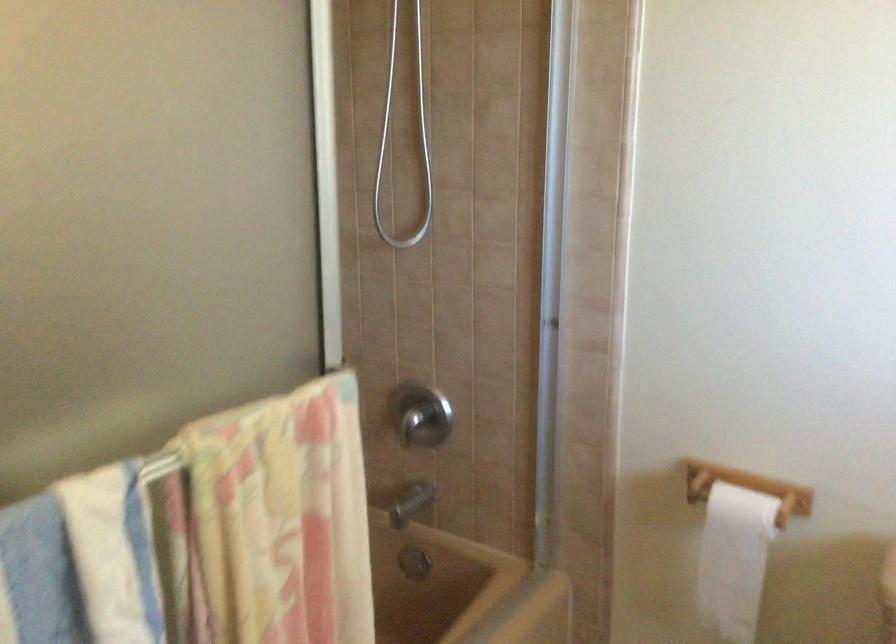
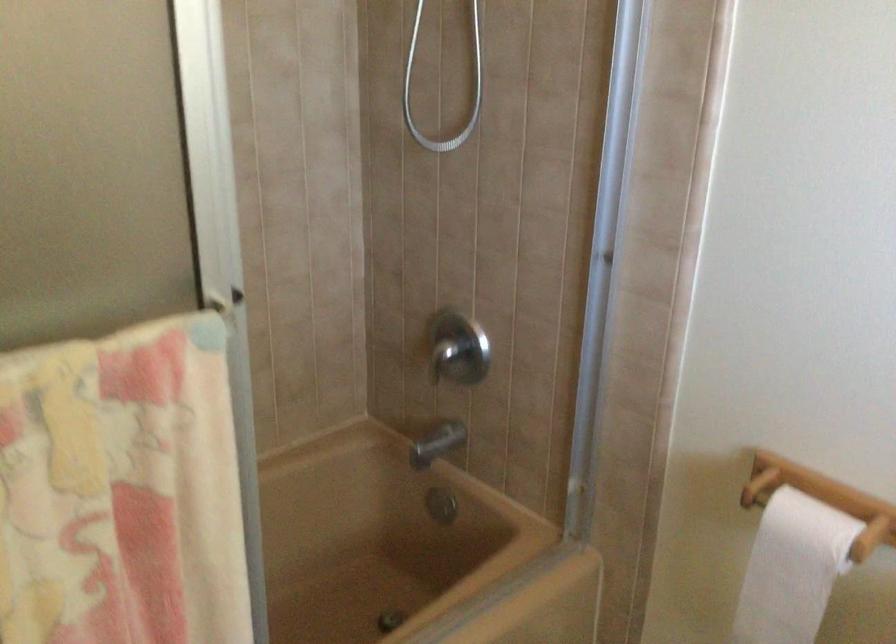
Question: The camera is either moving clockwise (left) or counter-clockwise (right) around the object. The first image is from the beginning of the video and the second image is from the end. Is the camera moving left or right when shooting the video?

Choices:
 (A) Left
 (B) Right

Answer: (B)